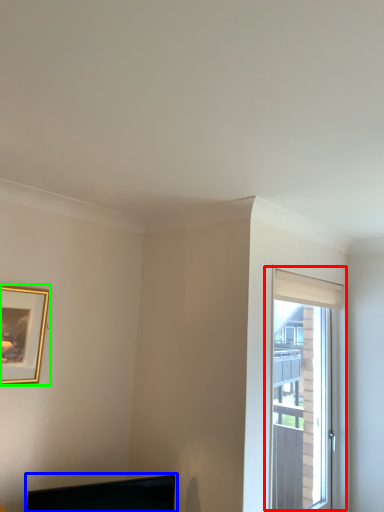
Question: Based on their relative distances, which object is nearer to window (highlighted by a red box)? Choose from computer monitor (highlighted by a blue box) and picture frame (highlighted by a green box).

Choices:
 (A) computer monitor
 (B) picture frame

Answer: (A)